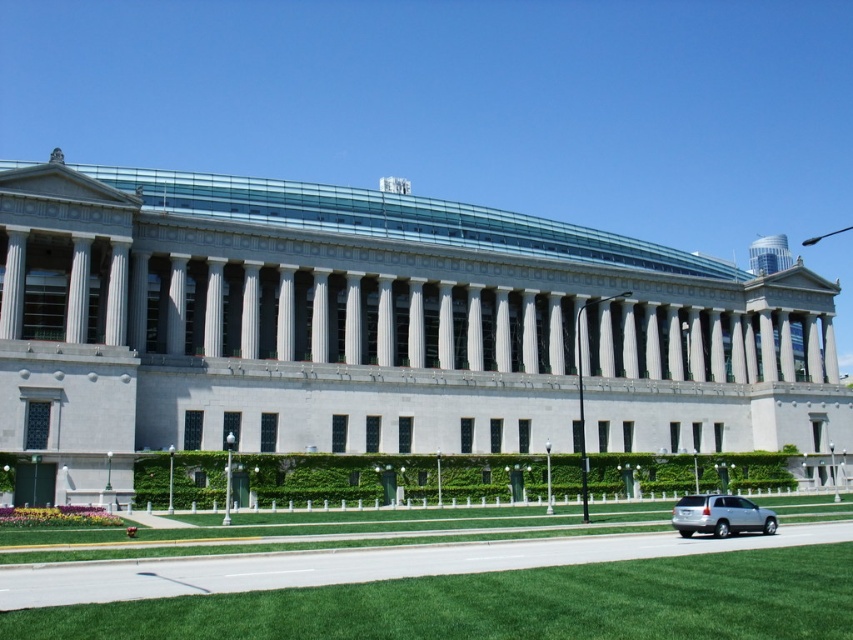
You are a visitor arriving at the grand neoclassical building. You see the green grass at lower center and the silver metallic suv at lower right. Which object is closer to the building?

The green grass at lower center is closer to the building than the silver metallic suv at lower right because it is located above it.

You are a visitor arriving at the grand neoclassical building. You see the green grass at lower center and the silver metallic suv at lower right. Which object takes up more space in the image?

The green grass at lower center takes up more space in the image than the silver metallic suv at lower right because it is bigger.